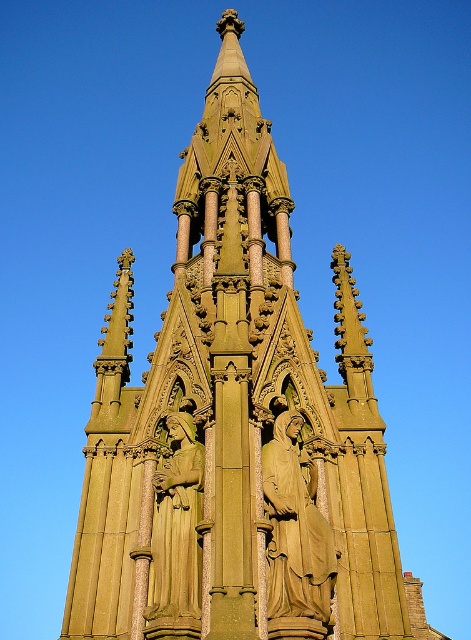
You are an art student standing in front of the monument and want to sketch the statues. Which statue, the golden stone statue at center or the green stone statue at center, is closer to you?

The golden stone statue at center is closer to you because it is further to the viewer than the green stone statue at center.

You are an architect planning to place a new decorative element between the golden stone statue at center and the green stone statue at center. The element requires a minimum of 15 feet of space. Can the statues be moved closer to accommodate this requirement?

The golden stone statue at center is 17.80 feet from the green stone statue at center. Since the required space is 15 feet, the statues can be moved closer by 2.8 feet to accommodate the decorative element.

You are an art restorer examining the monument. You need to clean both the golden stone statue at center and the green stone statue at center. Which statue should you clean first if you want to start from the lower one?

The golden stone statue at center should be cleaned first because it is located below the green stone statue at center.